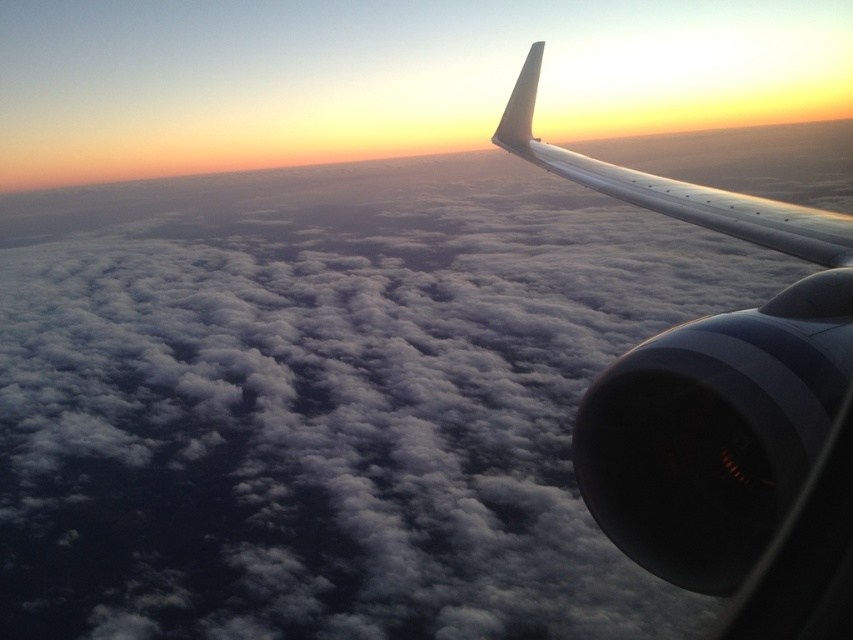
You are a passenger sitting at the window seat of the airplane. You notice two wings outside your window, the metallic gray wing at upper right and the sleek metallic wing at upper right. Which of these two wings is shorter?

The metallic gray wing at upper right is shorter than the sleek metallic wing at upper right.

You are a passenger sitting near the window and want to take a photo of both the metallic gray wing at upper right and the sleek metallic wing at upper right. Which wing should you position closer to the left side of your camera frame to include both in the photo?

The metallic gray wing at upper right is to the left of the sleek metallic wing at upper right, so you should position the metallic gray wing at upper right closer to the left side of your camera frame to include both wings in the photo.

You are a passenger sitting at the window seat of an airplane. You notice a specific point marked at coordinate (706,380) on the window. Based on the scene, can you identify what object this point is located on?

The point at coordinate (706,380) is located on the metallic gray wing at upper right.